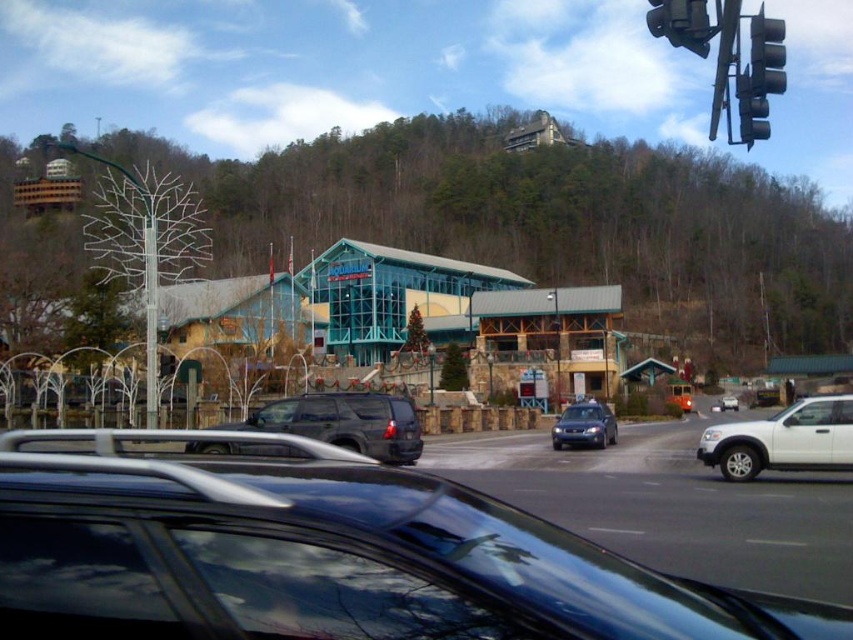
You are sitting in the car at the traffic light and want to know which of the two points, point (653, 13) or point (555, 426), is closer to you. Based on the scene, can you determine which one is nearer?

Point (653, 13) is closer to the viewer than point (555, 426).

You are sitting in the car and looking out the windshield. There are two points marked in the scene. Which point is closer to you, point 1 at coordinates (515, 566) or point 2 at coordinates (717, 424)?

Point 1 at coordinates (515, 566) is closer to you than point 2 at coordinates (717, 424).

You are sitting in a car parked at a traffic light. You notice a point on the dashboard at position [692,28]. If your arm is 0.5 meters long, can you reach that point?

The point at [692,28] is 9.72 meters away from the viewer. Since your arm is only 0.5 meters long, you cannot reach it.